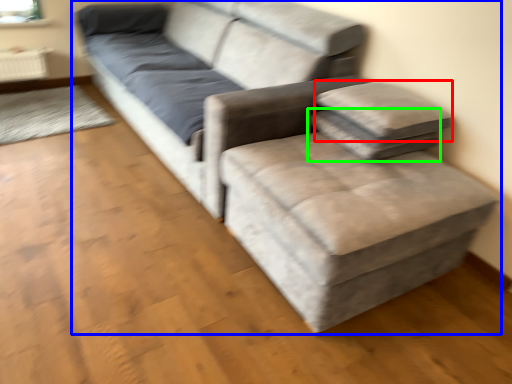
Question: Estimate the real-world distances between objects in this image. Which object is closer to pillow (highlighted by a red box), studio couch (highlighted by a blue box) or pillow (highlighted by a green box)?

Choices:
 (A) studio couch
 (B) pillow

Answer: (B)